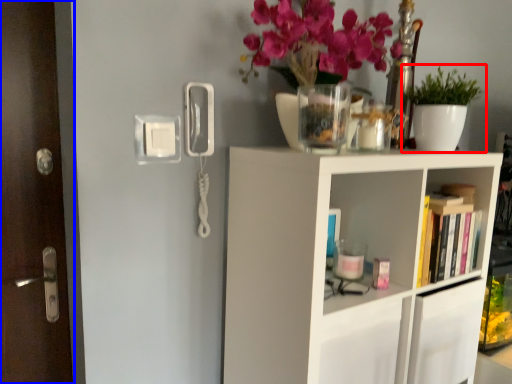
Question: Which object appears farthest to the camera in this image, houseplant (highlighted by a red box) or door (highlighted by a blue box)?

Choices:
 (A) houseplant
 (B) door

Answer: (A)